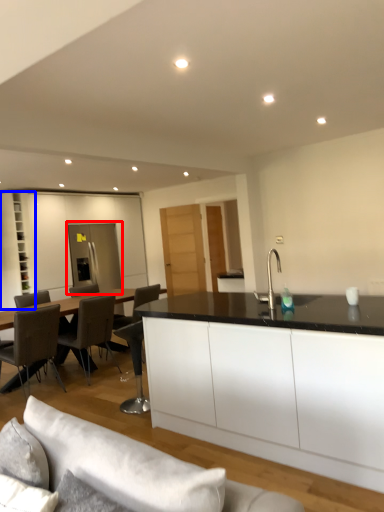
Question: Among these objects, which one is nearest to the camera, glass door (highlighted by a red box) or cabinetry (highlighted by a blue box)?

Choices:
 (A) glass door
 (B) cabinetry

Answer: (B)